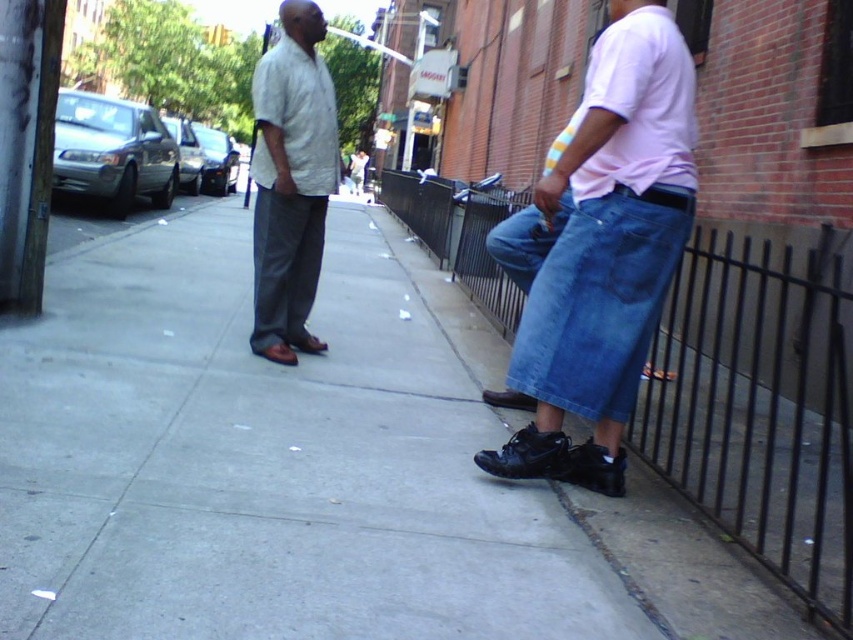
Question: Estimate the real-world distances between objects in this image. Which object is closer to the blue denim jeans at lower right?

Choices:
 (A) black leather sandal at lower right
 (B) concrete sidewalk at center
 (C) dark gray cotton pants at center
 (D) denim at right

Answer: (C)

Question: Which point is farther to the camera?

Choices:
 (A) (672, 372)
 (B) (579, 234)

Answer: (A)

Question: Can you confirm if denim jeans at right is positioned below black leather sandal at lower right?

Choices:
 (A) no
 (B) yes

Answer: (A)

Question: Is the position of denim at right less distant than that of blue denim jeans at lower right?

Choices:
 (A) no
 (B) yes

Answer: (B)

Question: Among these objects, which one is farthest from the camera?

Choices:
 (A) denim at right
 (B) light gray cotton shirt at center
 (C) dark gray cotton pants at center
 (D) blue denim jeans at lower right

Answer: (D)

Question: Does concrete sidewalk at center come in front of denim at right?

Choices:
 (A) yes
 (B) no

Answer: (A)